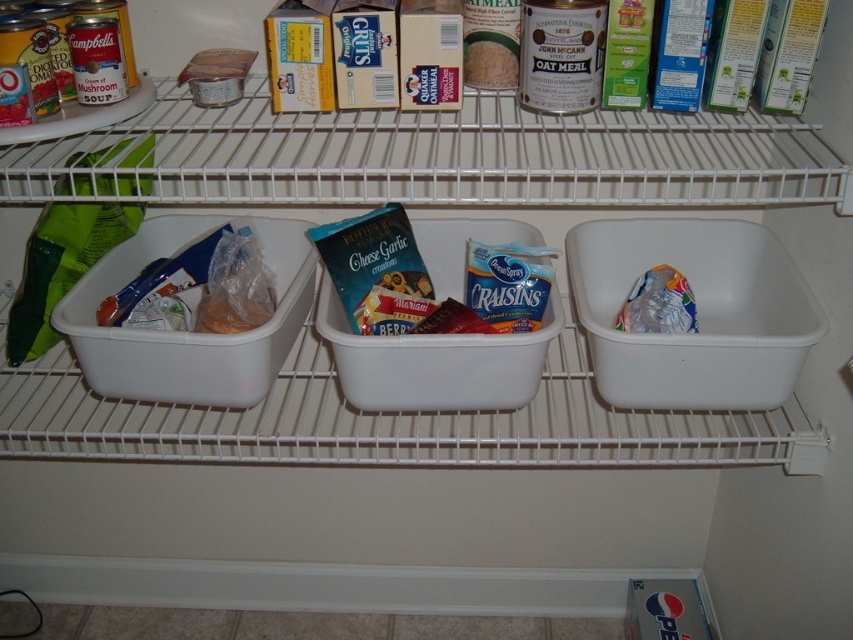
The image size is (853, 640). Describe the element at coordinates (659, 304) in the screenshot. I see `translucent plastic bag at center right` at that location.

Does translucent plastic bag at center right appear under smooth white rice at center?

Yes, translucent plastic bag at center right is below smooth white rice at center.

Is point (680, 273) farther from camera compared to point (515, 76)?

Yes, point (680, 273) is farther from viewer.

Find the location of a particular element. The height and width of the screenshot is (640, 853). translucent plastic bag at center right is located at coordinates (659, 304).